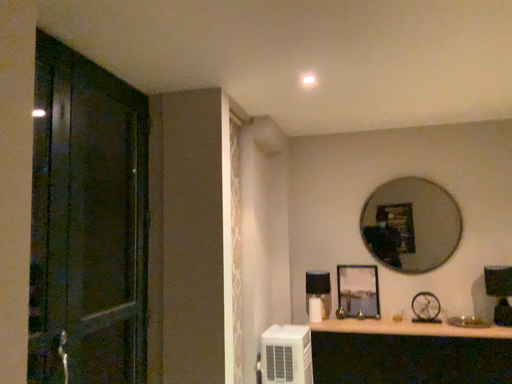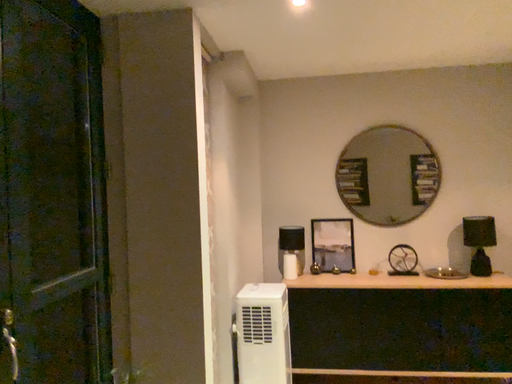
Question: Which way did the camera rotate in the video?

Choices:
 (A) rotated left
 (B) rotated right

Answer: (B)